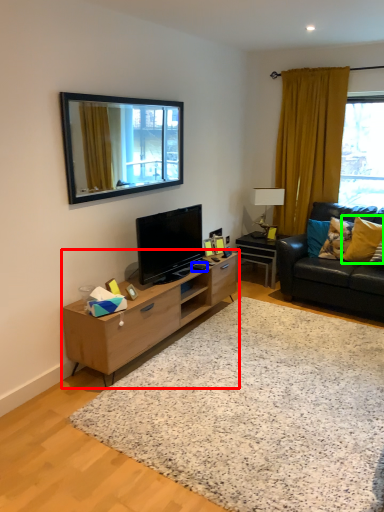
Question: Which is nearer to the cabinetry (highlighted by a red box)? remote control (highlighted by a blue box) or pillow (highlighted by a green box).

Choices:
 (A) remote control
 (B) pillow

Answer: (A)